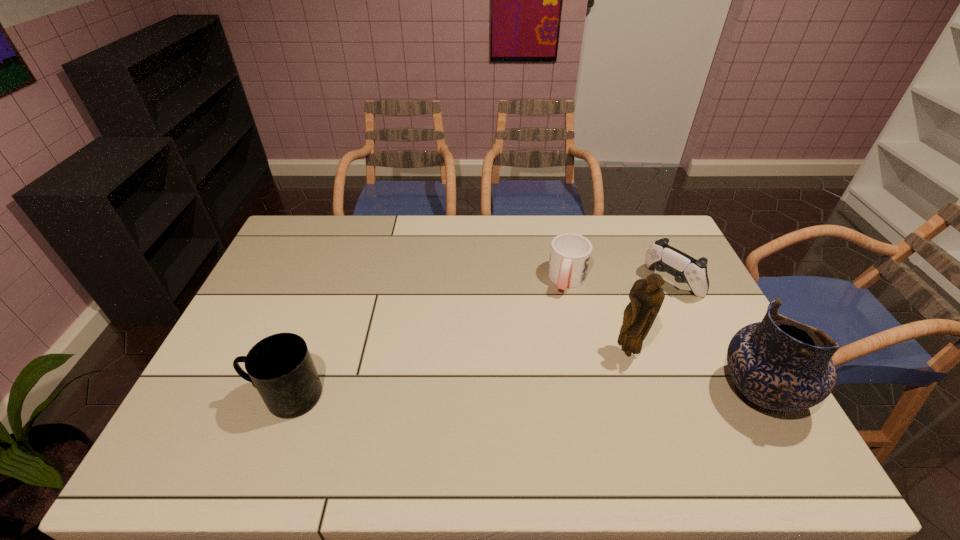
Locate an element on the screen. This screenshot has height=540, width=960. vacant region at the far left corner of the desktop is located at coordinates (307, 248).

The height and width of the screenshot is (540, 960). Find the location of `blank space at the near left corner`. blank space at the near left corner is located at coordinates (240, 416).

Where is `vacant space at the far right corner of the desktop`? vacant space at the far right corner of the desktop is located at coordinates (634, 223).

Identify the location of free region at the near right corner of the desktop. (723, 414).

Identify the location of free spot between the second object from left to right and the pottery. This screenshot has height=540, width=960. (662, 337).

You are a GUI agent. You are given a task and a screenshot of the screen. Output one action in this format:
    pyautogui.click(x=<x>, y=<y>)
    Task: Click on the empty space between the shorter mug and the third object from left to right
    The image size is (960, 540).
    Given the screenshot: What is the action you would take?
    pyautogui.click(x=598, y=316)

Where is `free space between the taller mug and the control`? free space between the taller mug and the control is located at coordinates (479, 339).

The width and height of the screenshot is (960, 540). What are the coordinates of `vacant area that lies between the third object from right to left and the leftmost object` in the screenshot? It's located at coord(458,375).

Image resolution: width=960 pixels, height=540 pixels. What are the coordinates of `blank region between the pottery and the figurine` in the screenshot? It's located at (693, 374).

Locate an element on the screen. free space between the nearer mug and the control is located at coordinates (479, 339).